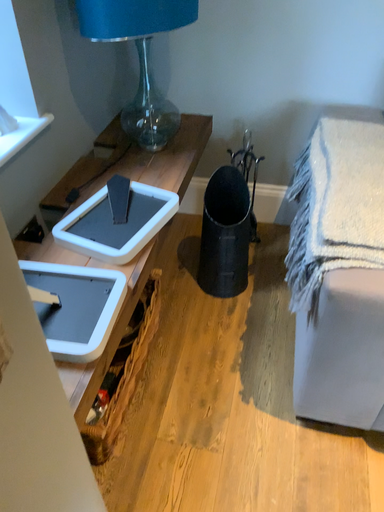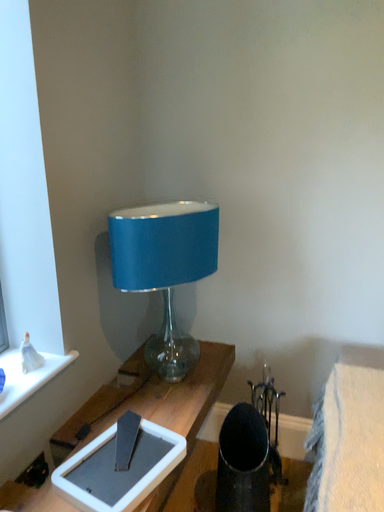
Question: How did the camera likely rotate when shooting the video?

Choices:
 (A) rotated right
 (B) rotated left

Answer: (B)